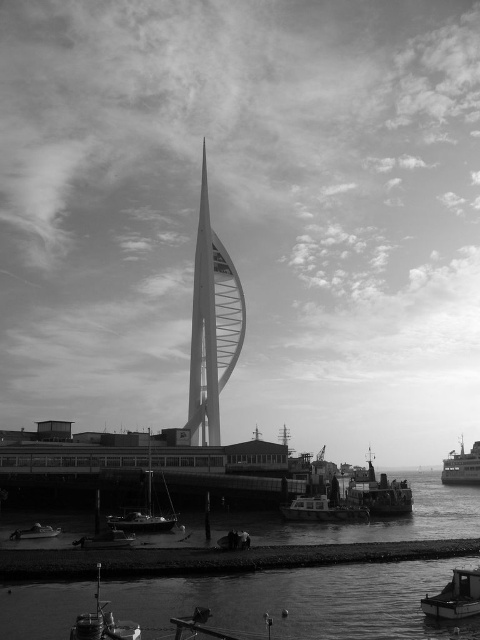
Question: Is the position of metallic sailboat at lower center less distant than that of metallic gray ship at lower right?

Choices:
 (A) yes
 (B) no

Answer: (A)

Question: Which point is closer to the camera taking this photo?

Choices:
 (A) (96, 538)
 (B) (145, 516)

Answer: (A)

Question: Is the position of metallic polished boat at lower center less distant than that of metallic sailboat at lower center?

Choices:
 (A) no
 (B) yes

Answer: (A)

Question: Which object appears closest to the camera in this image?

Choices:
 (A) metallic sailboat at lower center
 (B) smooth white spire at center

Answer: (A)

Question: Is metallic polished boat at lower center in front of metallic silver boat at lower center?

Choices:
 (A) no
 (B) yes

Answer: (A)

Question: Which point is farther to the camera?

Choices:
 (A) metallic silver boat at lower left
 (B) metallic silver boat at lower center
 (C) metallic sailboat at lower center

Answer: (C)